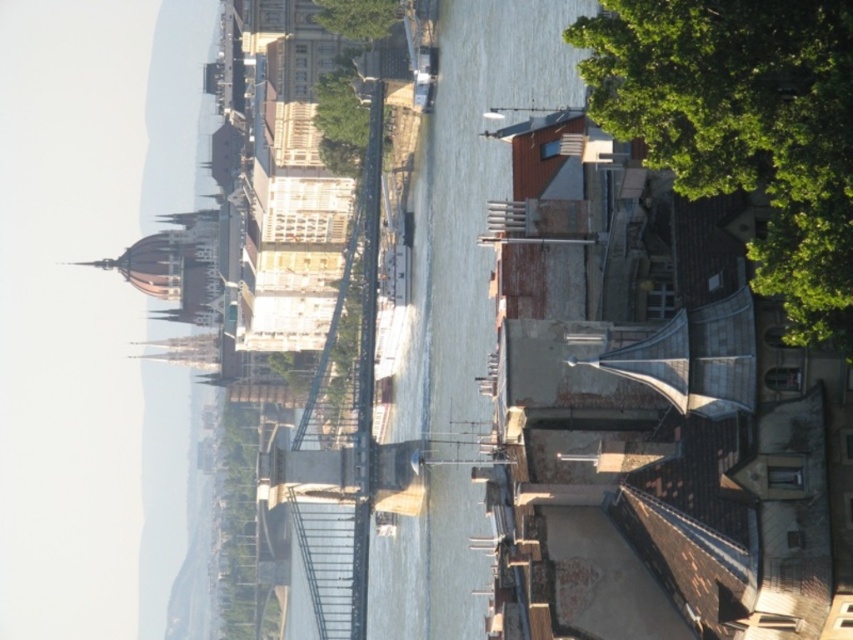
Does green leafy tree at upper right appear on the left side of green leafy tree at upper center?

Incorrect, green leafy tree at upper right is not on the left side of green leafy tree at upper center.

Which is in front, point (848, 278) or point (341, 19)?

Positioned in front is point (848, 278).

Is point (843, 170) farther from viewer compared to point (360, 10)?

No, it is in front of (360, 10).

You are a GUI agent. You are given a task and a screenshot of the screen. Output one action in this format:
    pyautogui.click(x=<x>, y=<y>)
    Task: Click on the green leafy tree at upper right
    
    Given the screenshot: What is the action you would take?
    pyautogui.click(x=743, y=128)

Does clear water at center have a lesser width compared to green leafy tree at upper center?

Incorrect, clear water at center's width is not less than green leafy tree at upper center's.

What do you see at coordinates (90, 310) in the screenshot? I see `clear water at center` at bounding box center [90, 310].

In order to click on clear water at center in this screenshot , I will do `click(90, 310)`.

How much distance is there between clear water at center and green leafy tree at upper right?

They are 473.37 meters apart.

Is clear water at center closer to camera compared to green leafy tree at upper right?

No, clear water at center is further to the viewer.

Is point (102, 131) positioned behind point (762, 10)?

Yes, it is.

The image size is (853, 640). I want to click on clear water at center, so click(90, 310).